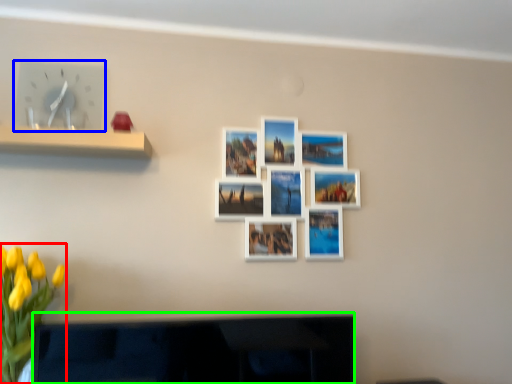
Question: Estimate the real-world distances between objects in this image. Which object is farther from floral arrangement (highlighted by a red box), clock (highlighted by a blue box) or television (highlighted by a green box)?

Choices:
 (A) clock
 (B) television

Answer: (A)